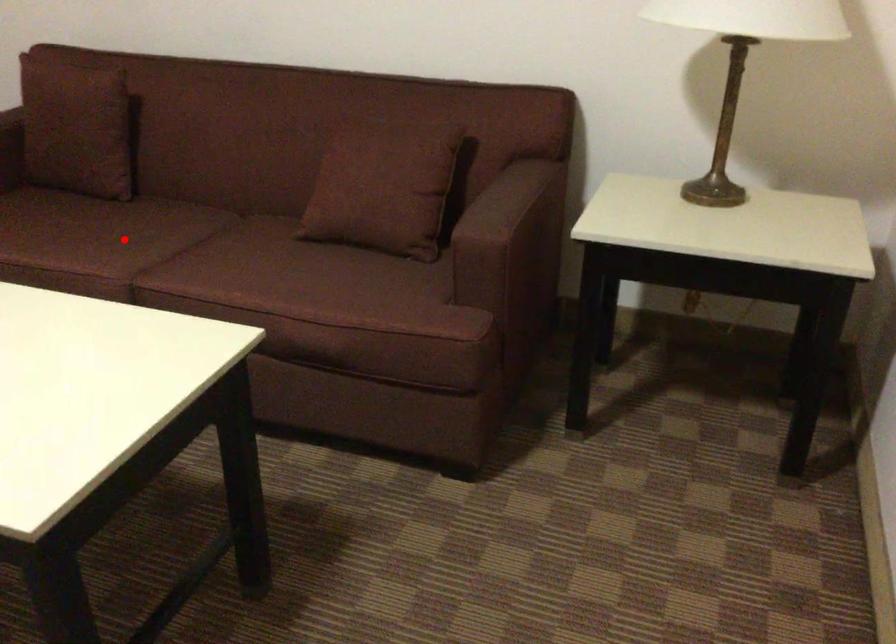
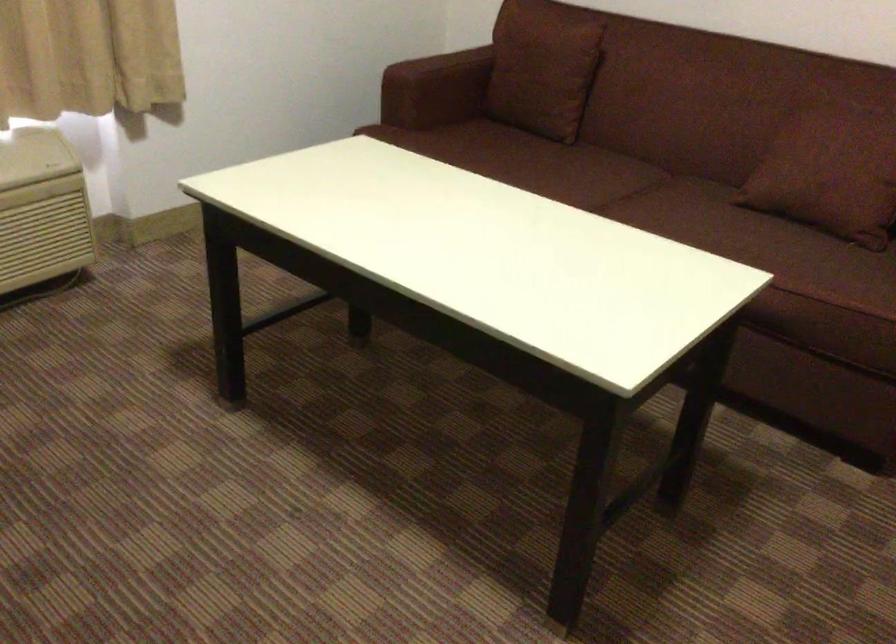
Find the pixel in the second image that matches the highlighted location in the first image.

(574, 176)